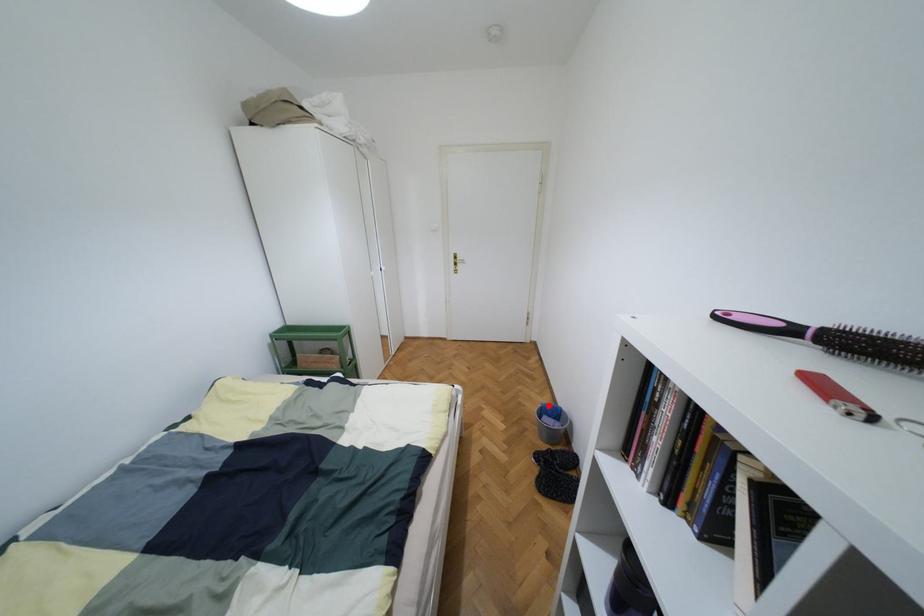
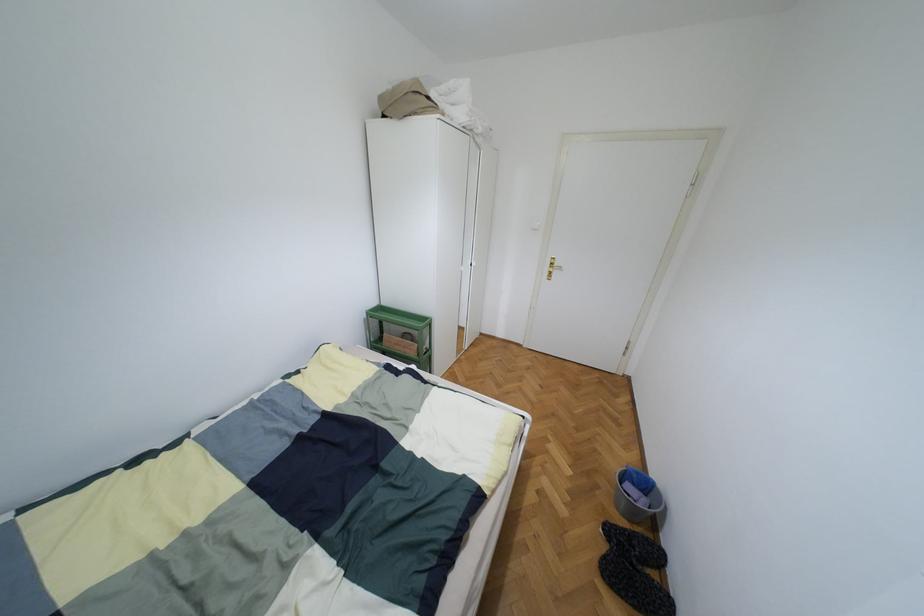
The point at the highlighted location is marked in the first image. Where is the corresponding point in the second image?

(638, 472)